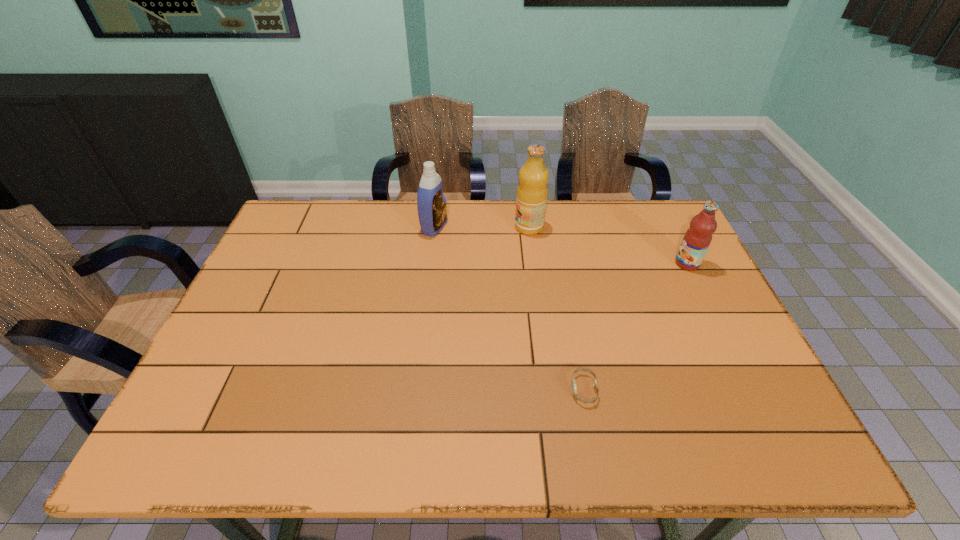
You are a GUI agent. You are given a task and a screenshot of the screen. Output one action in this format:
    pyautogui.click(x=<x>, y=<y>)
    Task: Click on the free space located 0.150m on the right of the leftmost object
    The width and height of the screenshot is (960, 540).
    Given the screenshot: What is the action you would take?
    pyautogui.click(x=493, y=227)

Locate an element on the screen. vacant space located 0.080m on the front label of the shorter fruit juice is located at coordinates (x=648, y=264).

Locate an element on the screen. free space located on the front label of the shorter fruit juice is located at coordinates (638, 264).

At what (x,y) coordinates should I click in order to perform the action: click on free space located on the front label of the shorter fruit juice. Please return your answer as a coordinate pair (x, y). The width and height of the screenshot is (960, 540). Looking at the image, I should click on (608, 264).

At what (x,y) coordinates should I click in order to perform the action: click on vacant space located on the face of the watch. Please return your answer as a coordinate pair (x, y). Looking at the image, I should click on (496, 389).

In order to click on vacant point located on the face of the watch in this screenshot , I will do `click(404, 389)`.

At what (x,y) coordinates should I click in order to perform the action: click on vacant space located 0.220m on the face of the watch. Please return your answer as a coordinate pair (x, y). The width and height of the screenshot is (960, 540). Looking at the image, I should click on (474, 389).

The width and height of the screenshot is (960, 540). I want to click on fruit juice positioned at the far edge, so click(x=532, y=191).

Find the location of `detergent located at the far edge`. detergent located at the far edge is located at coordinates click(432, 209).

What are the coordinates of `object situated at the right edge` in the screenshot? It's located at (697, 239).